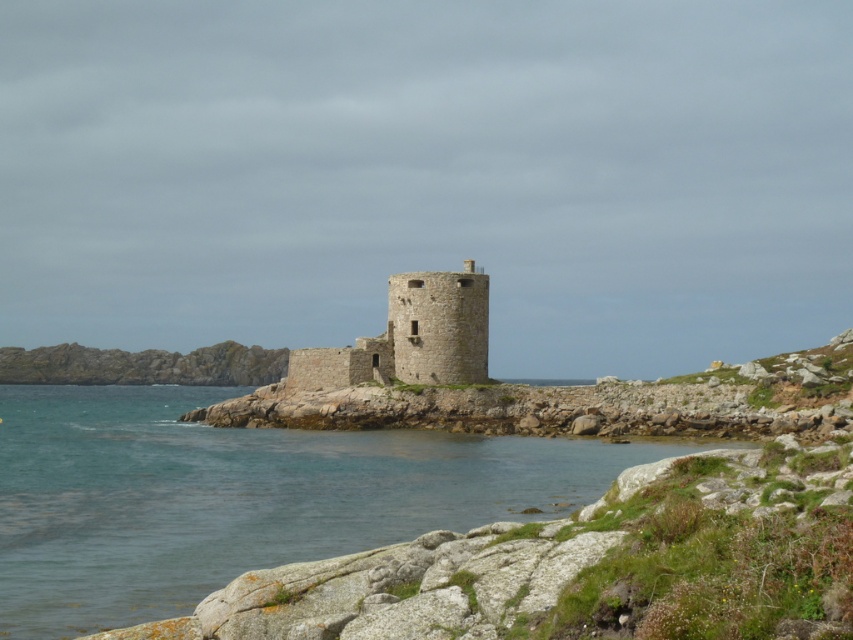
Can you confirm if clear water at lower left is positioned below stone tower at center?

Yes, clear water at lower left is below stone tower at center.

Can you confirm if clear water at lower left is thinner than stone tower at center?

No, clear water at lower left is not thinner than stone tower at center.

Image resolution: width=853 pixels, height=640 pixels. In order to click on clear water at lower left in this screenshot , I will do `click(241, 497)`.